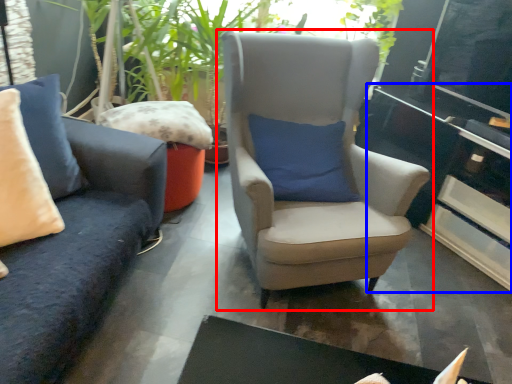
Question: Which point is closer to the camera, chair (highlighted by a red box) or table (highlighted by a blue box)?

Choices:
 (A) chair
 (B) table

Answer: (A)